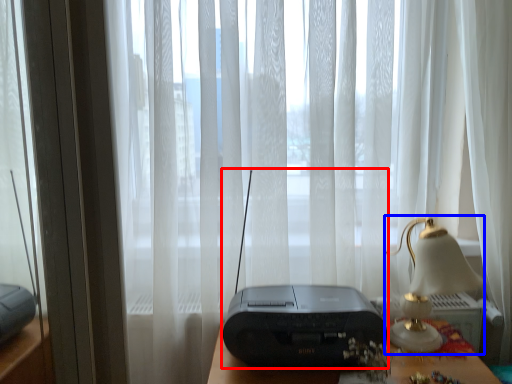
Question: Which object is further to the camera taking this photo, gadget (highlighted by a red box) or table lamp (highlighted by a blue box)?

Choices:
 (A) gadget
 (B) table lamp

Answer: (B)